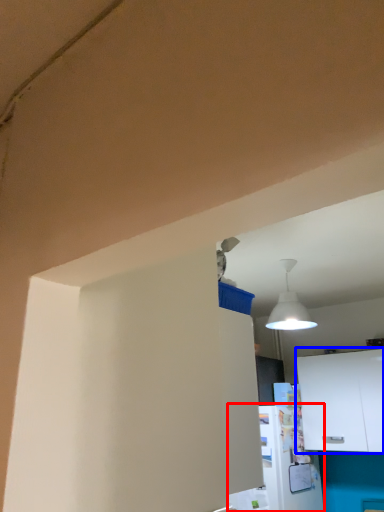
Question: Among these objects, which one is farthest to the camera, appliance (highlighted by a red box) or cabinetry (highlighted by a blue box)?

Choices:
 (A) appliance
 (B) cabinetry

Answer: (B)